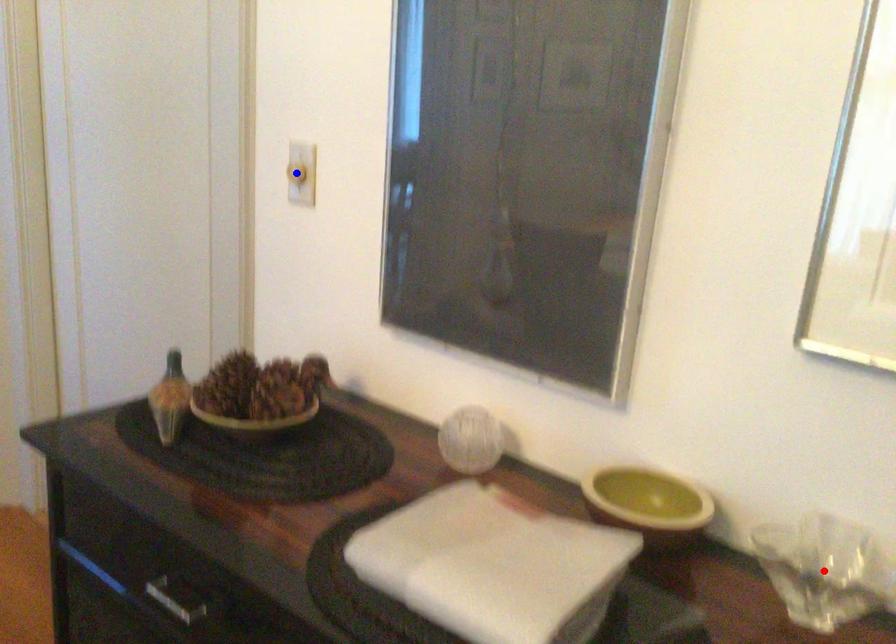
Question: In the image, two points are highlighted. Which point is nearer to the camera? Reply with the corresponding letter.

Choices:
 (A) blue point
 (B) red point

Answer: (B)